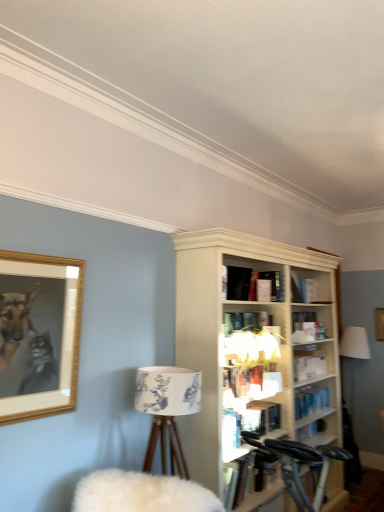
In order to face hardcover book at center, arranged as the 2th book when viewed from the top, should I rotate leftwards or rightwards?

You should rotate right by 7.562 degrees.

The width and height of the screenshot is (384, 512). Describe the element at coordinates (253, 381) in the screenshot. I see `hardcover book at center, the 1th book ordered from the bottom` at that location.

What do you see at coordinates (300, 465) in the screenshot?
I see `metallic silver bicycle at lower right` at bounding box center [300, 465].

Locate an element on the screen. The width and height of the screenshot is (384, 512). white fabric lampshade at lower right is located at coordinates (350, 449).

Locate an element on the screen. wooden picture frame at upper left is located at coordinates (39, 334).

Are white fabric lampshade at lower right and matte black book at upper center, which is the 1th book in top-to-bottom order, far apart?

Yes, white fabric lampshade at lower right is far from matte black book at upper center, which is the 1th book in top-to-bottom order.

Does white fabric lampshade at lower right have a smaller size compared to matte black book at upper center, the 2th book from the bottom?

Incorrect, white fabric lampshade at lower right is not smaller in size than matte black book at upper center, the 2th book from the bottom.

From the image's perspective, is white fabric lampshade at lower right below matte black book at upper center, which is the 1th book in top-to-bottom order?

Correct, white fabric lampshade at lower right appears lower than matte black book at upper center, which is the 1th book in top-to-bottom order, in the image.

Is point (343, 343) closer to camera compared to point (246, 276)?

No.

Can you confirm if wooden picture frame at upper left is wider than white fabric lampshade at lower right?

In fact, wooden picture frame at upper left might be narrower than white fabric lampshade at lower right.

Measure the distance from wooden picture frame at upper left to white fabric lampshade at lower right.

wooden picture frame at upper left is 3.33 meters from white fabric lampshade at lower right.

Could you tell me if wooden picture frame at upper left is turned towards white fabric lampshade at lower right?

No, wooden picture frame at upper left does not turn towards white fabric lampshade at lower right.

Based on the photo, based on their sizes in the image, would you say wooden picture frame at upper left is bigger or smaller than white fluffy swivel chair at lower left?

Clearly, wooden picture frame at upper left is smaller in size than white fluffy swivel chair at lower left.

Considering the positions of objects wooden picture frame at upper left and white fluffy swivel chair at lower left in the image provided, who is behind, wooden picture frame at upper left or white fluffy swivel chair at lower left?

wooden picture frame at upper left is further from the camera.

Which of these two, wooden picture frame at upper left or white fluffy swivel chair at lower left, is wider?

Wider between the two is white fluffy swivel chair at lower left.

Does point (52, 272) come behind point (173, 492)?

Yes, it is.

Is white fluffy swivel chair at lower left inside metallic silver bicycle at lower right?

That's incorrect, white fluffy swivel chair at lower left is not inside metallic silver bicycle at lower right.

From a real-world perspective, relative to white fluffy swivel chair at lower left, is metallic silver bicycle at lower right vertically above or below?

From a real-world perspective, metallic silver bicycle at lower right is physically below white fluffy swivel chair at lower left.

Looking at their sizes, would you say metallic silver bicycle at lower right is wider or thinner than white fluffy swivel chair at lower left?

Considering their sizes, metallic silver bicycle at lower right looks slimmer than white fluffy swivel chair at lower left.

Could you measure the distance between matte black book at upper center, which is the 1th book in top-to-bottom order, and hardcover book at center, arranged as the 2th book when viewed from the top?

24.70 inches.

Which of these two, matte black book at upper center, which is the 1th book in top-to-bottom order, or hardcover book at center, the 1th book ordered from the bottom, stands taller?

matte black book at upper center, which is the 1th book in top-to-bottom order, is taller.

Considering the relative sizes of matte black book at upper center, the 2th book from the bottom, and hardcover book at center, the 1th book ordered from the bottom, in the image provided, is matte black book at upper center, the 2th book from the bottom, thinner than hardcover book at center, the 1th book ordered from the bottom,?

Incorrect, the width of matte black book at upper center, the 2th book from the bottom, is not less than that of hardcover book at center, the 1th book ordered from the bottom.

Is matte black book at upper center, which is the 1th book in top-to-bottom order, completely or partially outside of hardcover book at center, arranged as the 2th book when viewed from the top?

Yes, matte black book at upper center, which is the 1th book in top-to-bottom order, is not within hardcover book at center, arranged as the 2th book when viewed from the top.

The image size is (384, 512). Identify the location of bicycle below the white fabric lampshade at lower right (from a real-world perspective). (300, 465).

Can you confirm if white fabric lampshade at lower right is wider than metallic silver bicycle at lower right?

Incorrect, the width of white fabric lampshade at lower right does not surpass that of metallic silver bicycle at lower right.

How many degrees apart are the facing directions of white fabric lampshade at lower right and metallic silver bicycle at lower right?

The angle between the facing direction of white fabric lampshade at lower right and the facing direction of metallic silver bicycle at lower right is 3.05 degrees.

From the picture: Are white fabric lampshade at lower right and metallic silver bicycle at lower right located far from each other?

Yes, white fabric lampshade at lower right is far from metallic silver bicycle at lower right.

Which of these two, matte black book at upper center, which is the 1th book in top-to-bottom order, or white fabric lampshade at upper center, stands shorter?

With less height is matte black book at upper center, which is the 1th book in top-to-bottom order.

Is matte black book at upper center, the 2th book from the bottom, in contact with white fabric lampshade at upper center?

matte black book at upper center, the 2th book from the bottom, is not next to white fabric lampshade at upper center, and they're not touching.

Considering the sizes of matte black book at upper center, the 2th book from the bottom, and white fabric lampshade at upper center in the image, is matte black book at upper center, the 2th book from the bottom, wider or thinner than white fabric lampshade at upper center?

matte black book at upper center, the 2th book from the bottom, is thinner than white fabric lampshade at upper center.

The width and height of the screenshot is (384, 512). I want to click on table lamp lying on the right of matte black book at upper center, the 2th book from the bottom, so click(350, 449).

In the image, there is a wooden picture frame at upper left. At what (x,y) coordinates should I click in order to perform the action: click on table lamp below it (from a real-world perspective). Please return your answer as a coordinate pair (x, y). Looking at the image, I should click on (350, 449).

Which object lies further to the anchor point white fabric lampshade at lower right, wooden picture frame at upper left or white fabric lampshade at upper center?

The object further to white fabric lampshade at lower right is wooden picture frame at upper left.

When comparing their distances from white fluffy swivel chair at lower left, does wooden picture frame at upper left or metallic silver bicycle at lower right seem further?

Based on the image, metallic silver bicycle at lower right appears to be further to white fluffy swivel chair at lower left.

Looking at the image, which one is located further to white fabric lampshade at lower right, white fabric lampshade at upper center or white fluffy swivel chair at lower left?

The object further to white fabric lampshade at lower right is white fluffy swivel chair at lower left.

When comparing their distances from wooden picture frame at upper left, does metallic silver bicycle at lower right or white fabric lampshade at upper center seem further?

metallic silver bicycle at lower right.

From the image, which object appears to be nearer to metallic silver bicycle at lower right, white fabric lampshade at lower right or hardcover book at center, arranged as the 2th book when viewed from the top?

hardcover book at center, arranged as the 2th book when viewed from the top, is closer to metallic silver bicycle at lower right.

Estimate the real-world distances between objects in this image. Which object is further from metallic silver bicycle at lower right, hardcover book at center, arranged as the 2th book when viewed from the top, or wooden picture frame at upper left?

wooden picture frame at upper left is further to metallic silver bicycle at lower right.

Looking at the image, which one is located closer to white fabric lampshade at upper center, metallic silver bicycle at lower right or wooden picture frame at upper left?

metallic silver bicycle at lower right is closer to white fabric lampshade at upper center.

Based on their spatial positions, is matte black book at upper center, which is the 1th book in top-to-bottom order, or white fabric lampshade at lower right closer to metallic silver bicycle at lower right?

white fabric lampshade at lower right lies closer to metallic silver bicycle at lower right than the other object.

Identify the location of bicycle positioned between wooden picture frame at upper left and white fabric lampshade at lower right from near to far. (300, 465).

I want to click on lamp between wooden picture frame at upper left and hardcover book at center, the 1th book ordered from the bottom, so click(x=252, y=348).

Locate an element on the screen. The height and width of the screenshot is (512, 384). swivel chair located between wooden picture frame at upper left and metallic silver bicycle at lower right in the left-right direction is located at coordinates (141, 493).

The image size is (384, 512). I want to click on bicycle between white fluffy swivel chair at lower left and white fabric lampshade at lower right along the z-axis, so click(300, 465).